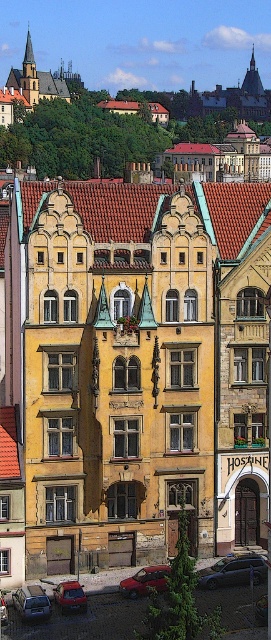
You are a pedestrian standing on the cobblestone street in front of the ornate buildings. You see two cars parked at the lower left of your view. Which car is closer to the center of the street, the metallic silver car at lower left or the metallic red car at lower left?

The metallic silver car at lower left is to the right of the metallic red car at lower left, so the metallic silver car at lower left is closer to the center of the street.

You are standing on the cobblestone street in the scene and want to walk towards the buildings. Which of the two points, point (14, 598) or point (4, 605), is closer to you as you face the buildings?

Point (4, 605) is closer to you because point (14, 598) is behind it.

You are a delivery person who needs to park your vehicle in this street. You have a tall delivery van that requires a parking spot with enough vertical clearance. Based on the image, which car among the metallic silver car at lower left and metallic red car at lower center is safer to park next to if you want to ensure your van doesn not hit the building above?

The metallic silver car at lower left has a lesser height compared to metallic red car at lower center, so parking next to the metallic silver car at lower left would provide more vertical clearance for your tall delivery van to avoid hitting the building above.